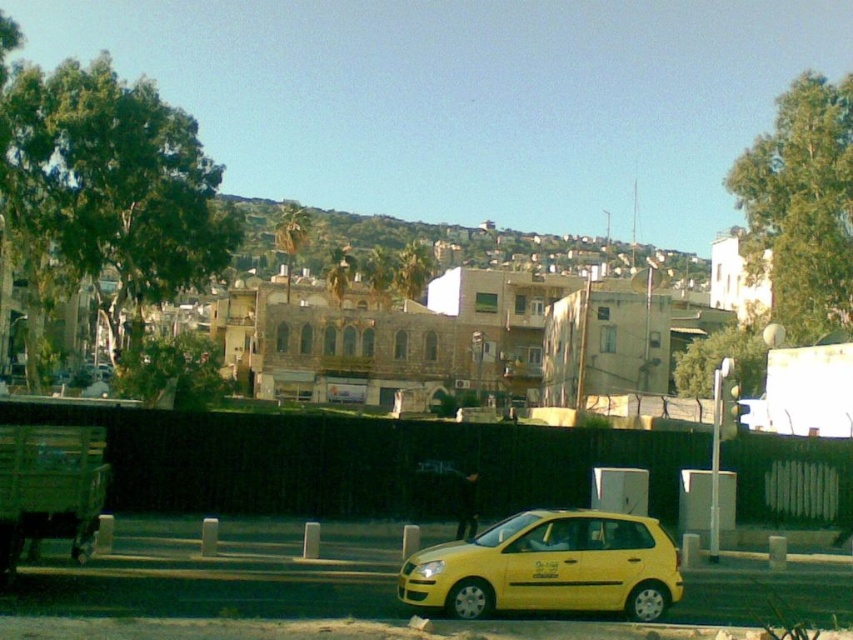
Question: Can you confirm if yellow matte car at lower center is bigger than green grassy hillside at upper center?

Choices:
 (A) no
 (B) yes

Answer: (A)

Question: Is the position of yellow matte car at lower center less distant than that of green grassy hillside at upper center?

Choices:
 (A) yes
 (B) no

Answer: (A)

Question: Is the position of yellow matte car at lower center more distant than that of green grassy hillside at upper center?

Choices:
 (A) yes
 (B) no

Answer: (B)

Question: Which of the following is the farthest from the observer?

Choices:
 (A) yellow matte car at lower center
 (B) green grassy hillside at upper center

Answer: (B)

Question: Which of the following is the farthest from the observer?

Choices:
 (A) green grassy hillside at upper center
 (B) yellow matte car at lower center

Answer: (A)